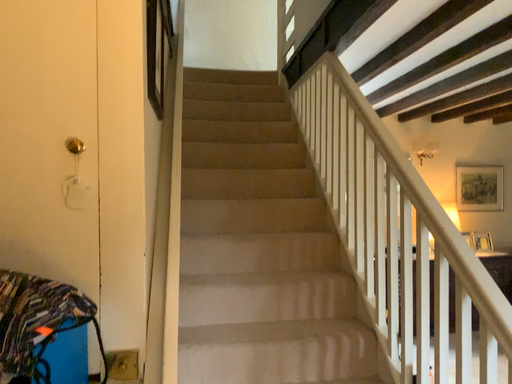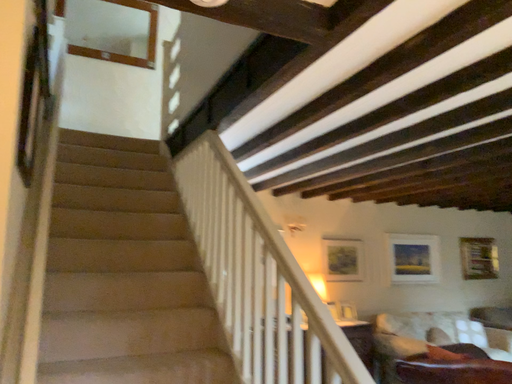
Question: How did the camera likely rotate when shooting the video?

Choices:
 (A) rotated upward
 (B) rotated downward

Answer: (A)